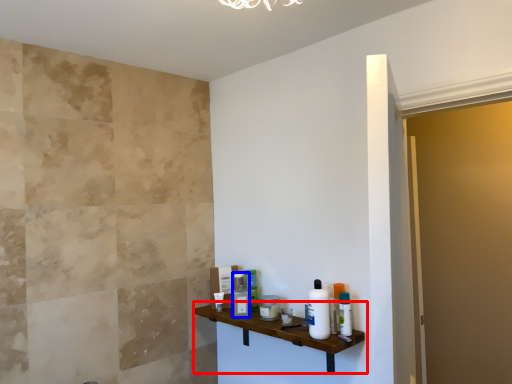
Question: Which object is further to the camera taking this photo, shelf (highlighted by a red box) or toiletry (highlighted by a blue box)?

Choices:
 (A) shelf
 (B) toiletry

Answer: (B)